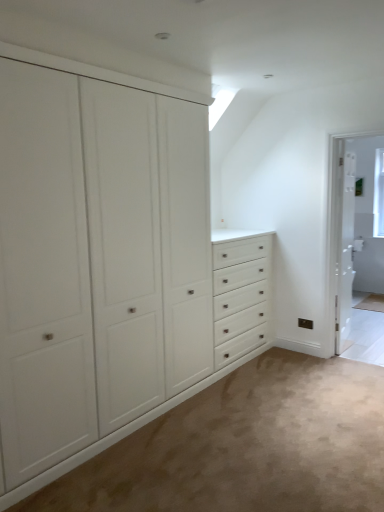
Question: Does white wooden screen door at right appear on the left side of white matte cabinet at left?

Choices:
 (A) no
 (B) yes

Answer: (A)

Question: Is white wooden screen door at right bigger than white matte cabinet at left?

Choices:
 (A) yes
 (B) no

Answer: (B)

Question: Are white wooden screen door at right and white matte cabinet at left making contact?

Choices:
 (A) yes
 (B) no

Answer: (B)

Question: From a real-world perspective, is white wooden screen door at right over white matte cabinet at left?

Choices:
 (A) no
 (B) yes

Answer: (A)

Question: Does white wooden screen door at right have a lesser width compared to white matte cabinet at left?

Choices:
 (A) no
 (B) yes

Answer: (B)

Question: Does white wooden screen door at right have a smaller size compared to white matte cabinet at left?

Choices:
 (A) yes
 (B) no

Answer: (A)

Question: Is white glossy door at right at the left side of white matte cabinet at left?

Choices:
 (A) no
 (B) yes

Answer: (A)

Question: Is white glossy door at right taller than white matte cabinet at left?

Choices:
 (A) no
 (B) yes

Answer: (A)

Question: Can you confirm if white glossy door at right is wider than white matte cabinet at left?

Choices:
 (A) no
 (B) yes

Answer: (A)

Question: From the image's perspective, does white glossy door at right appear lower than white matte cabinet at left?

Choices:
 (A) yes
 (B) no

Answer: (B)

Question: Does white glossy door at right have a lesser height compared to white matte cabinet at left?

Choices:
 (A) no
 (B) yes

Answer: (B)

Question: Is white glossy door at right not inside white matte cabinet at left?

Choices:
 (A) no
 (B) yes

Answer: (B)

Question: From the image's perspective, does white wooden screen door at right appear lower than white glossy door at right?

Choices:
 (A) yes
 (B) no

Answer: (A)